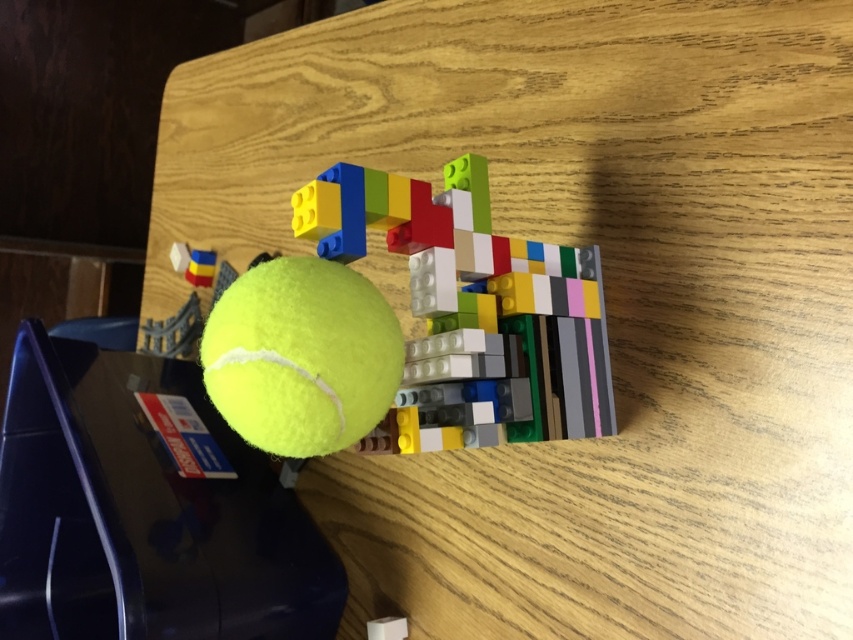
Question: Is multicolored plastic blocks at center further to the viewer compared to yellow matte tennis ball at center?

Choices:
 (A) no
 (B) yes

Answer: (B)

Question: Which object is farther from the camera taking this photo?

Choices:
 (A) multicolored plastic blocks at center
 (B) yellow matte tennis ball at center

Answer: (A)

Question: Does multicolored plastic blocks at center appear over yellow matte tennis ball at center?

Choices:
 (A) yes
 (B) no

Answer: (A)

Question: Does multicolored plastic blocks at center have a lesser width compared to yellow matte tennis ball at center?

Choices:
 (A) yes
 (B) no

Answer: (B)

Question: Which object is farther from the camera taking this photo?

Choices:
 (A) yellow matte tennis ball at center
 (B) multicolored plastic blocks at center

Answer: (B)

Question: Among these points, which one is farthest from the camera?

Choices:
 (A) [x=431, y=198]
 (B) [x=218, y=307]

Answer: (A)